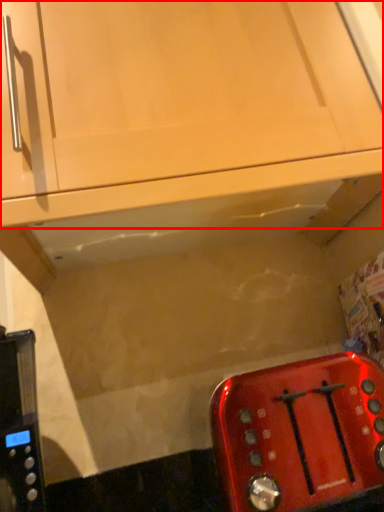
Question: From the image's perspective, where is cabinetry (annotated by the red box) located in relation to toaster in the image?

Choices:
 (A) below
 (B) above

Answer: (B)